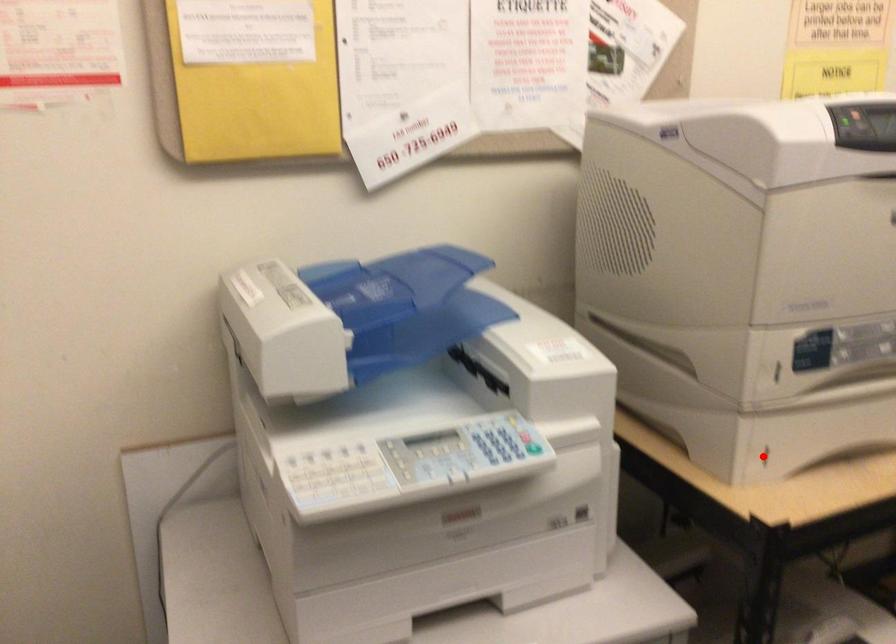
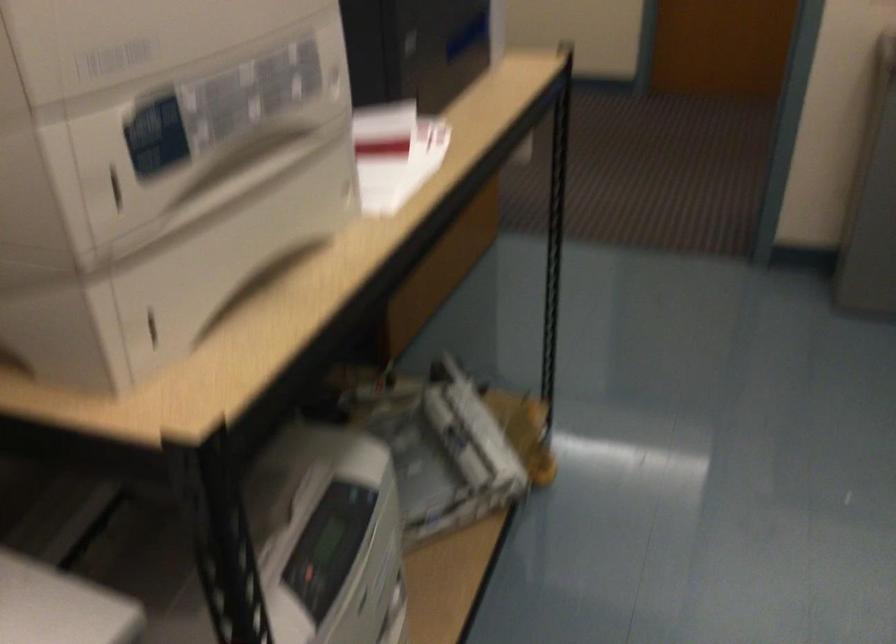
Question: I am providing you with two images of the same scene from different viewpoints. In image1, a red point is highlighted. Considering the same 3D point in image2, which of the following is correct?

Choices:
 (A) It is closer
 (B) It is farther

Answer: (A)